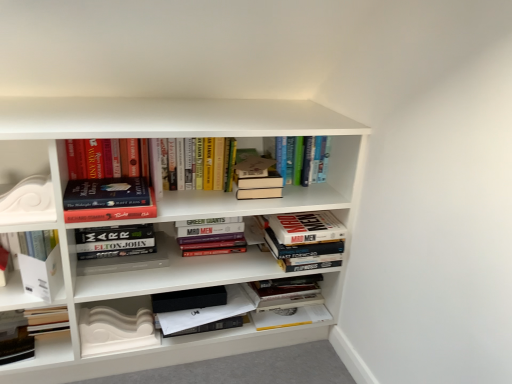
Question: Is white glossy decorative element at left to the left or to the right of hardcover book at center, the fifth book in the left-to-right sequence, in the image?

Choices:
 (A) left
 (B) right

Answer: (A)

Question: From the image's perspective, is white glossy decorative element at left positioned above or below hardcover book at center, which appears as the 2th book when viewed from the right?

Choices:
 (A) above
 (B) below

Answer: (A)

Question: Considering the real-world distances, which object is farthest from the white matte book at lower left, the 2th paperback book from the right?

Choices:
 (A) hardcover book at upper center, which is counted as the first book, starting from the right
 (B) white matte decorative piece at lower left, which ranks as the 2th paperback book in left-to-right order
 (C) hardcover book at lower left, the first book positioned from the left
 (D) white glossy decorative element at left
 (E) hardcover book at center, the fifth book in the left-to-right sequence

Answer: (A)

Question: Considering the real-world distances, which object is closest to the white glossy decorative element at left?

Choices:
 (A) hardcover book at upper center, the sixth book from the left
 (B) hardcover book at lower left, the first book positioned from the left
 (C) hardcover book at center, the 3th book positioned from the right
 (D) hardcover book at upper left, arranged as the second book when viewed from the left
 (E) hardcover books at center, arranged as the third book when viewed from the left

Answer: (D)